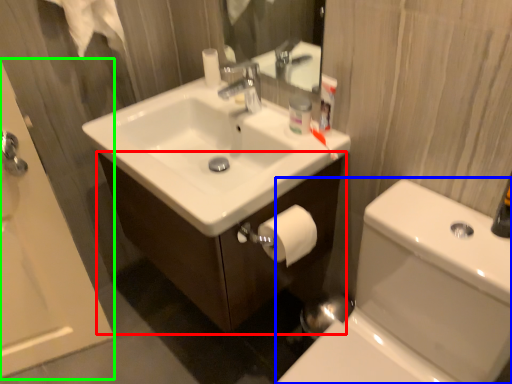
Question: Estimate the real-world distances between objects in this image. Which object is closer to bathroom cabinet (highlighted by a red box), toilet bowl (highlighted by a blue box) or bath (highlighted by a green box)?

Choices:
 (A) toilet bowl
 (B) bath

Answer: (A)